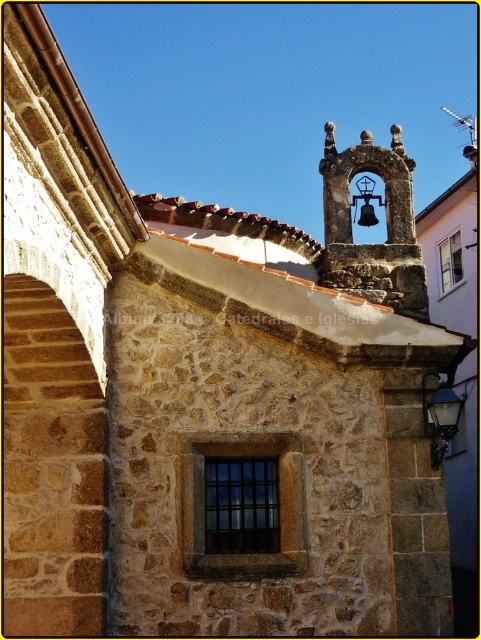
Where is `brown stone window at center`? Image resolution: width=481 pixels, height=640 pixels. brown stone window at center is located at coordinates (277, 509).

Can you confirm if brown stone window at center is thinner than white glass window at upper right?

In fact, brown stone window at center might be wider than white glass window at upper right.

Is point (270, 435) closer to camera compared to point (441, 244)?

Yes, point (270, 435) is in front of point (441, 244).

At what (x,y) coordinates should I click in order to perform the action: click on brown stone window at center. Please return your answer as a coordinate pair (x, y). This screenshot has width=481, height=640. Looking at the image, I should click on (277, 509).

Who is higher up, black glass window at center or white glass window at upper right?

white glass window at upper right is higher up.

Does point (278, 500) lie in front of point (444, 259)?

That is True.

Locate an element on the screen. black glass window at center is located at coordinates (240, 506).

Between brown stone window at center and black glass window at center, which one has more height?

black glass window at center

In the scene shown: Which is more to the left, brown stone window at center or black glass window at center?

black glass window at center is more to the left.

Between point (192, 436) and point (255, 516), which one is positioned behind?

Positioned behind is point (255, 516).

At what (x,y) coordinates should I click in order to perform the action: click on brown stone window at center. Please return your answer as a coordinate pair (x, y). Image resolution: width=481 pixels, height=640 pixels. Looking at the image, I should click on pyautogui.click(x=277, y=509).